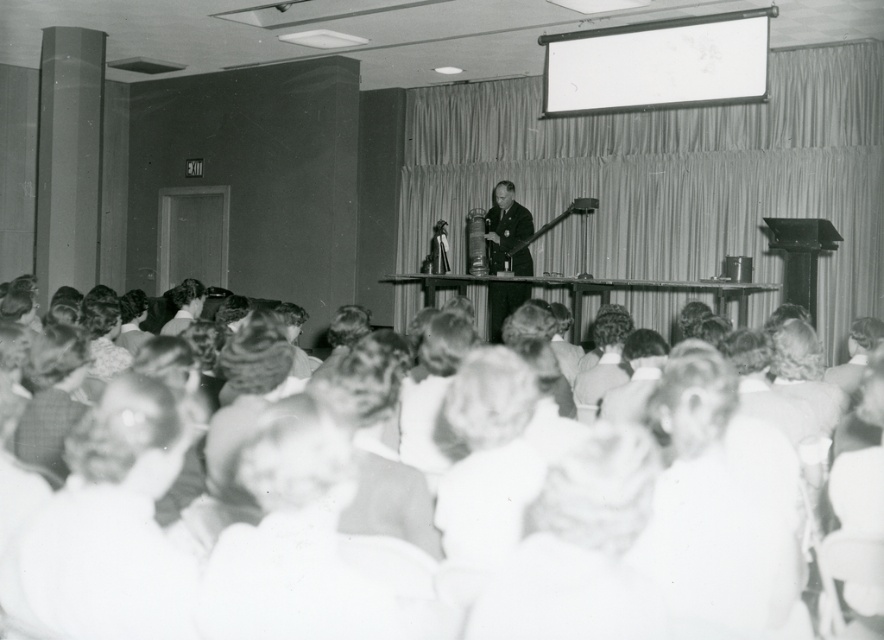
Does white cotton shirt at lower left have a larger size compared to white cotton shirt at lower right?

No.

Is white cotton shirt at lower left shorter than white cotton shirt at lower right?

Yes.

Who is more forward, (112, 483) or (768, 611)?

Point (768, 611)

Locate an element on the screen. white cotton shirt at lower left is located at coordinates (108, 529).

Is white cotton shirt at lower left wider than dark suit at center?

Indeed, white cotton shirt at lower left has a greater width compared to dark suit at center.

Which is in front, point (117, 529) or point (497, 289)?

Point (117, 529) is in front.

This screenshot has width=884, height=640. I want to click on white cotton shirt at lower left, so click(x=108, y=529).

Is white cotton shirt at lower right to the left of dark suit at center from the viewer's perspective?

No, white cotton shirt at lower right is not to the left of dark suit at center.

Who is taller, white cotton shirt at lower right or dark suit at center?

With more height is dark suit at center.

The height and width of the screenshot is (640, 884). What do you see at coordinates (721, 500) in the screenshot?
I see `white cotton shirt at lower right` at bounding box center [721, 500].

At what (x,y) coordinates should I click in order to perform the action: click on white cotton shirt at lower right. Please return your answer as a coordinate pair (x, y). Looking at the image, I should click on (721, 500).